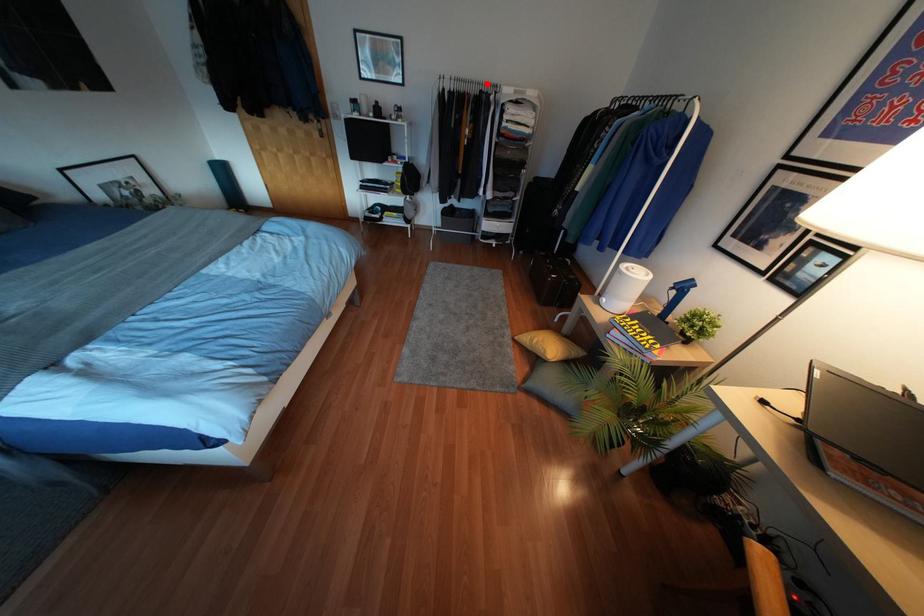
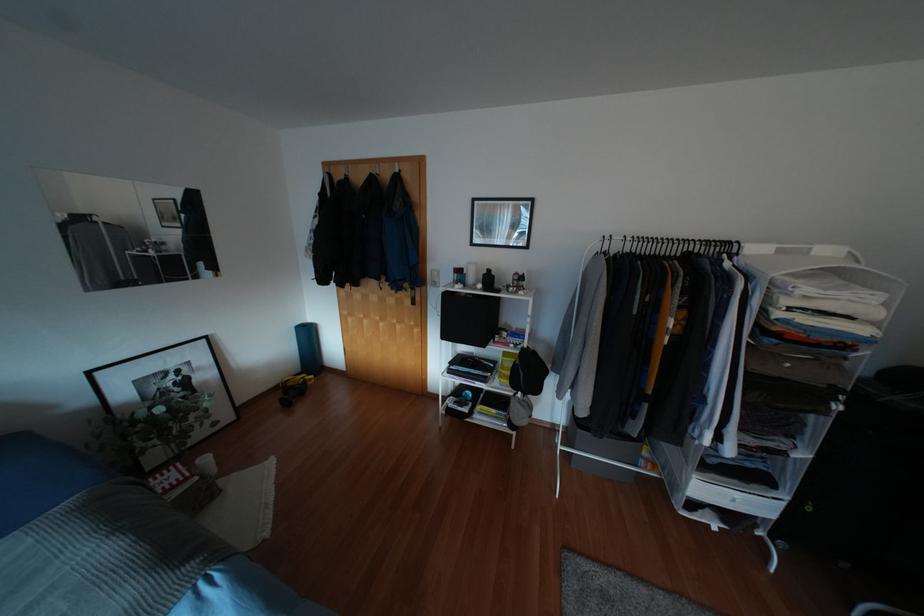
Question: A red point is marked in image1. In image2, is the corresponding 3D point closer to the camera or farther? Reply with the corresponding letter.

Choices:
 (A) The corresponding 3D point is closer.
 (B) The corresponding 3D point is farther.

Answer: (B)